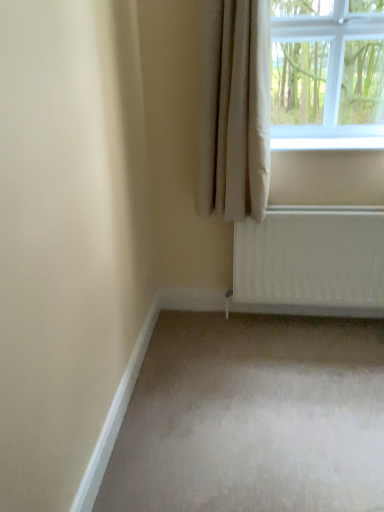
Question: Does white plastic window sill at upper right touch beige fabric curtain at upper right?

Choices:
 (A) no
 (B) yes

Answer: (A)

Question: Is there a large distance between white plastic window sill at upper right and beige fabric curtain at upper right?

Choices:
 (A) yes
 (B) no

Answer: (B)

Question: Is white plastic window sill at upper right oriented away from beige fabric curtain at upper right?

Choices:
 (A) yes
 (B) no

Answer: (B)

Question: Is white plastic window sill at upper right facing towards beige fabric curtain at upper right?

Choices:
 (A) no
 (B) yes

Answer: (A)

Question: Considering the relative sizes of white plastic window sill at upper right and beige fabric curtain at upper right in the image provided, is white plastic window sill at upper right bigger than beige fabric curtain at upper right?

Choices:
 (A) no
 (B) yes

Answer: (A)

Question: Is the depth of white plastic window sill at upper right greater than that of beige fabric curtain at upper right?

Choices:
 (A) yes
 (B) no

Answer: (A)

Question: Can you confirm if white glass window at upper right is thinner than beige fabric curtain at upper right?

Choices:
 (A) no
 (B) yes

Answer: (A)

Question: Does white glass window at upper right contain beige fabric curtain at upper right?

Choices:
 (A) no
 (B) yes

Answer: (A)

Question: From a real-world perspective, is white glass window at upper right under beige fabric curtain at upper right?

Choices:
 (A) no
 (B) yes

Answer: (A)

Question: Is white glass window at upper right far from beige fabric curtain at upper right?

Choices:
 (A) yes
 (B) no

Answer: (B)

Question: Does white glass window at upper right turn towards beige fabric curtain at upper right?

Choices:
 (A) yes
 (B) no

Answer: (B)

Question: Can you confirm if white glass window at upper right is wider than beige fabric curtain at upper right?

Choices:
 (A) no
 (B) yes

Answer: (B)

Question: Is white plastic window sill at upper right not inside white glass window at upper right?

Choices:
 (A) no
 (B) yes

Answer: (A)